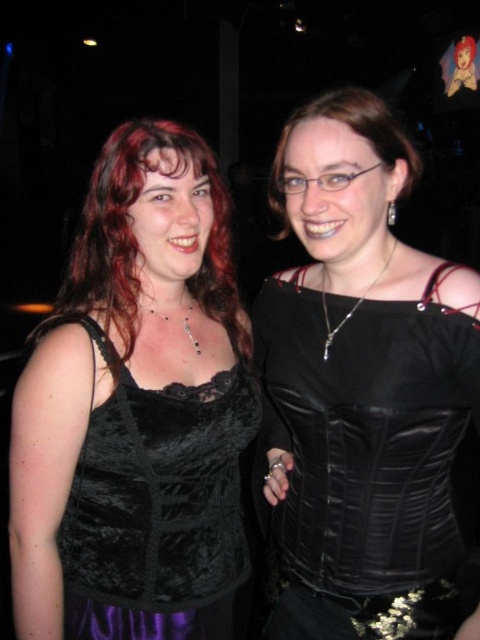
Looking at this image, who is positioned more to the left, velvet black top at left or matte black lace top at left?

From the viewer's perspective, velvet black top at left appears more on the left side.

Between velvet black top at left and matte black lace top at left, which one is positioned higher?

matte black lace top at left is higher up.

The height and width of the screenshot is (640, 480). What do you see at coordinates (135, 392) in the screenshot?
I see `velvet black top at left` at bounding box center [135, 392].

At what (x,y) coordinates should I click in order to perform the action: click on velvet black top at left. Please return your answer as a coordinate pair (x, y). Image resolution: width=480 pixels, height=640 pixels. Looking at the image, I should click on (135, 392).

Is point (148, 170) in front of point (352, 108)?

No, (148, 170) is behind (352, 108).

Is matte black lace top at left wider than matte black corset at center?

Yes.

Locate an element on the screen. The height and width of the screenshot is (640, 480). matte black lace top at left is located at coordinates (135, 237).

You are a GUI agent. You are given a task and a screenshot of the screen. Output one action in this format:
    pyautogui.click(x=<x>, y=<y>)
    Task: Click on the matte black lace top at left
    
    Given the screenshot: What is the action you would take?
    pyautogui.click(x=135, y=237)

Which is more to the left, satin black corset at center or matte black corset at center?

satin black corset at center

Is satin black corset at center closer to the viewer compared to matte black corset at center?

Yes, it is.

Find the location of `satin black corset at center`. satin black corset at center is located at coordinates point(361,387).